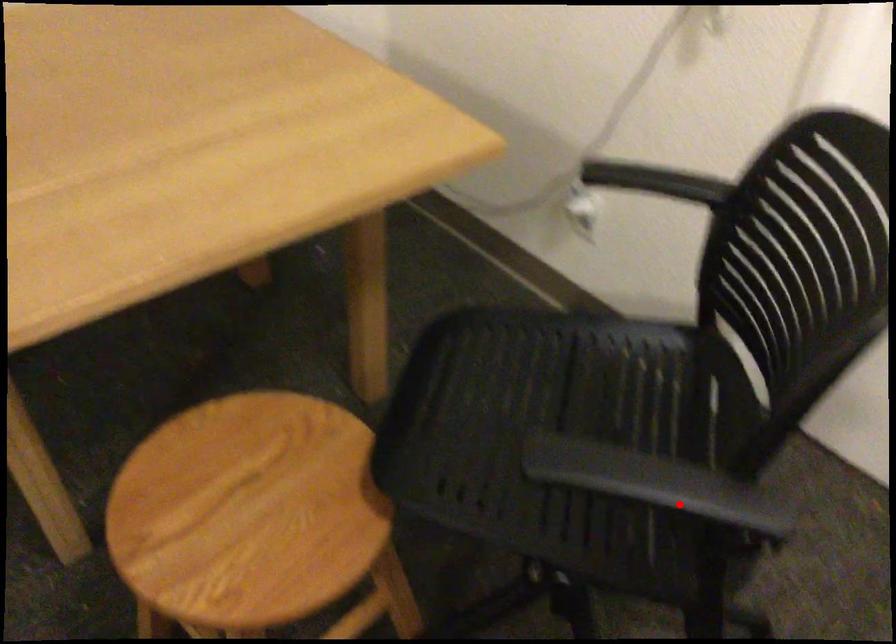
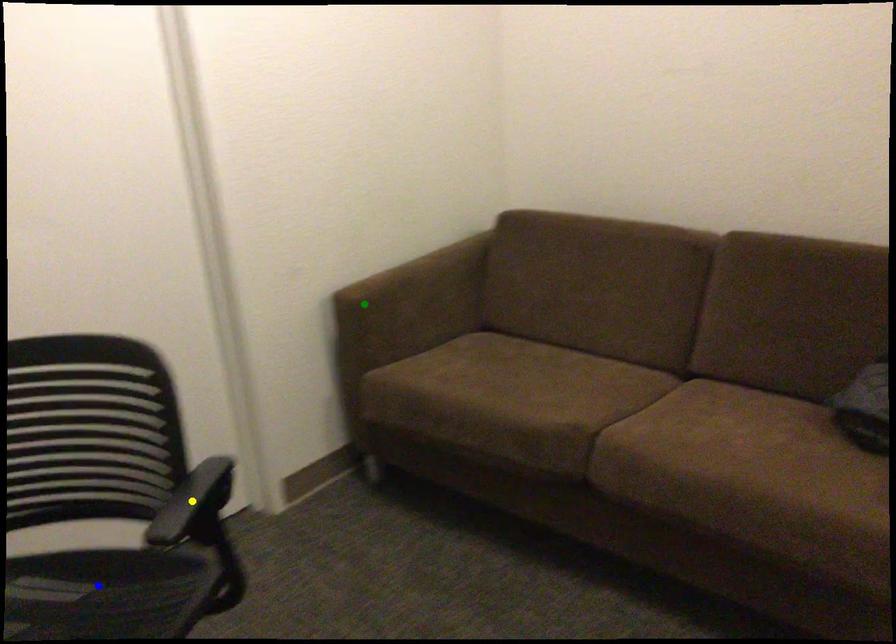
Question: I am providing you with two images of the same scene from different viewpoints. A red point is marked on the first image. You are given multiple points on the second image. In image 2, which mark is for the same physical point as the one in image 1?

Choices:
 (A) yellow point
 (B) green point
 (C) blue point

Answer: (A)